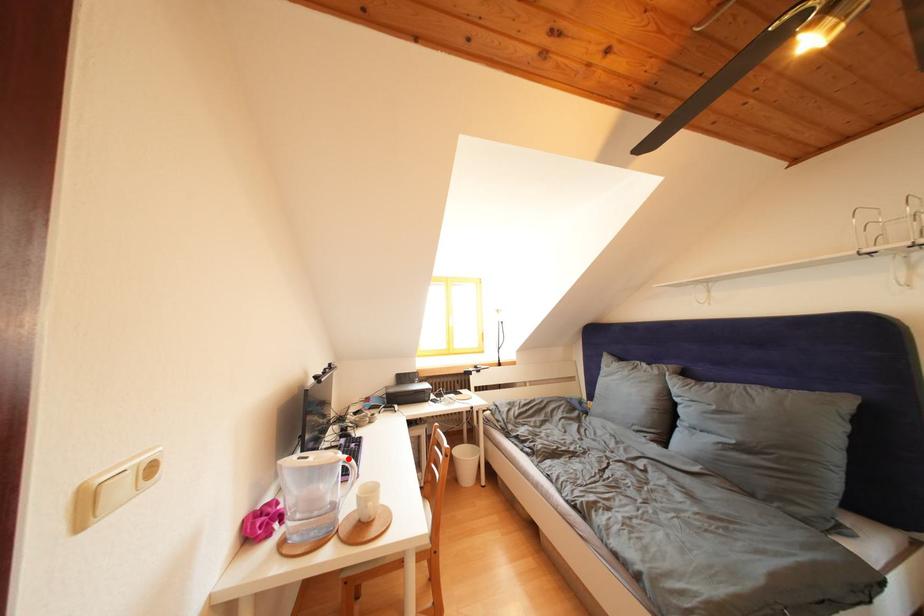
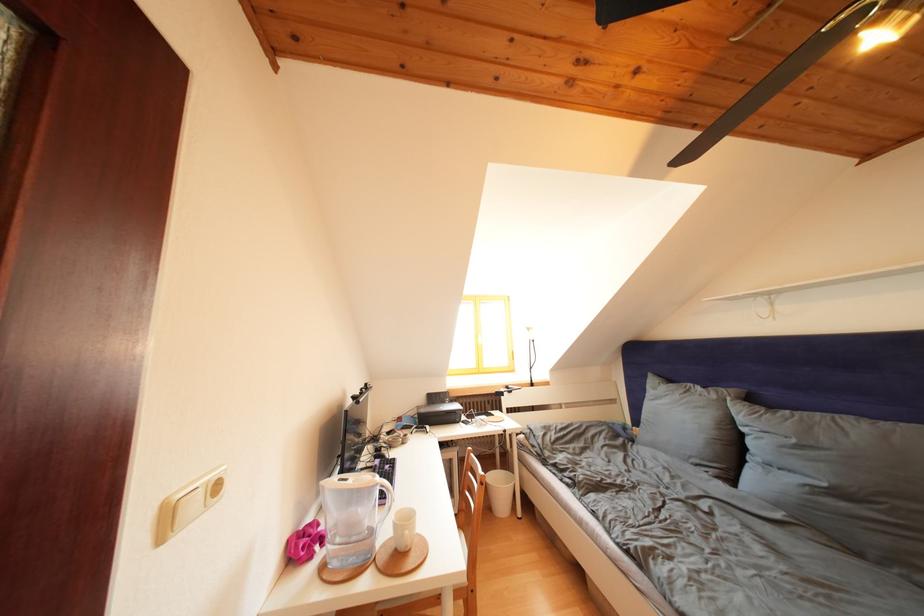
In the second image, find the point that corresponds to the highlighted location in the first image.

(385, 482)